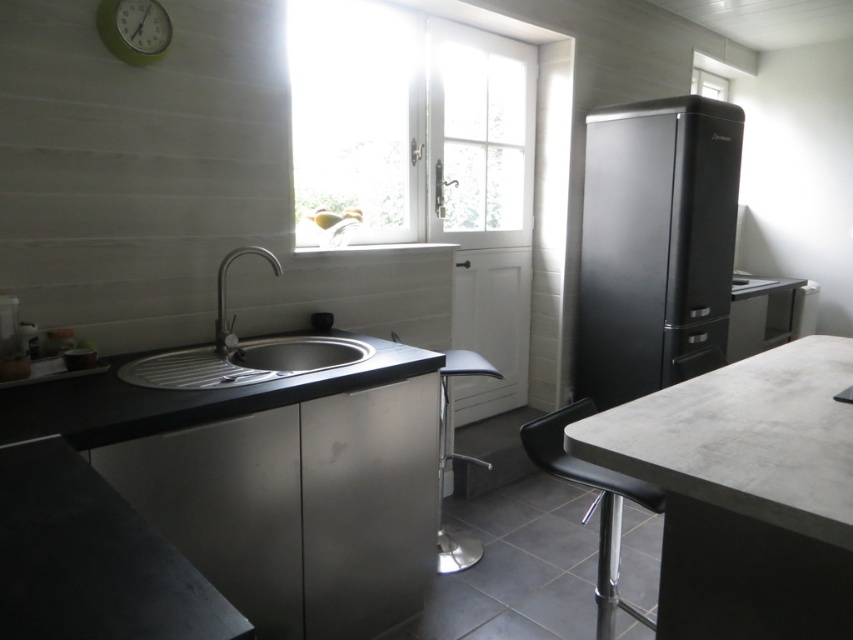
Does black matte refrigerator at right come in front of green matte clock at upper left?

No, it is behind green matte clock at upper left.

Does black matte refrigerator at right appear on the left side of green matte clock at upper left?

No, black matte refrigerator at right is not to the left of green matte clock at upper left.

Measure the distance between point [677,378] and camera.

The distance of point [677,378] from camera is 7.97 feet.

This screenshot has width=853, height=640. I want to click on black matte refrigerator at right, so click(654, 244).

Which is more to the right, satin nickel sink at center or black leather bar stool at lower right?

From the viewer's perspective, black leather bar stool at lower right appears more on the right side.

Is satin nickel sink at center to the right of black leather bar stool at lower right from the viewer's perspective?

In fact, satin nickel sink at center is to the left of black leather bar stool at lower right.

Between point (160, 372) and point (625, 609), which one is positioned behind?

Point (160, 372)

Locate an element on the screen. This screenshot has width=853, height=640. satin nickel sink at center is located at coordinates (241, 352).

Locate an element on the screen. This screenshot has height=640, width=853. black matte refrigerator at right is located at coordinates (654, 244).

Find the location of a particular element. Image resolution: width=853 pixels, height=640 pixels. black matte refrigerator at right is located at coordinates pyautogui.click(x=654, y=244).